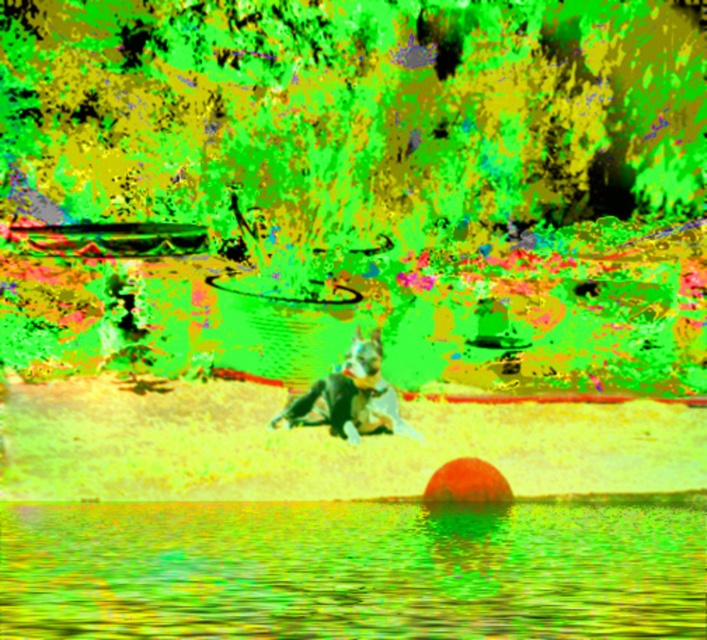
Question: Can you confirm if smooth water at lower center is positioned above black matte dog at center?

Choices:
 (A) yes
 (B) no

Answer: (B)

Question: From the image, what is the correct spatial relationship of smooth water at lower center in relation to black matte dog at center?

Choices:
 (A) right
 (B) left

Answer: (B)

Question: Which point is farther to the camera?

Choices:
 (A) (351, 384)
 (B) (490, 568)

Answer: (A)

Question: Can you confirm if smooth water at lower center is positioned to the right of black matte dog at center?

Choices:
 (A) no
 (B) yes

Answer: (A)